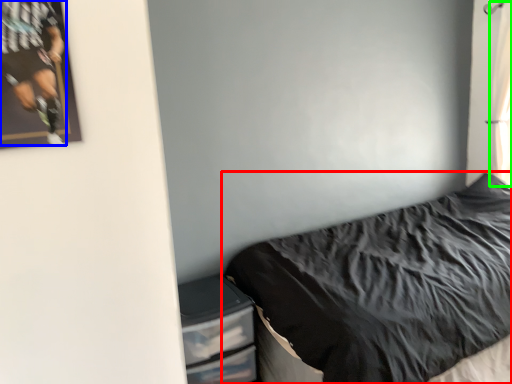
Question: Considering the real-world distances, which object is farthest from bed (highlighted by a red box)? person (highlighted by a blue box) or curtain (highlighted by a green box)?

Choices:
 (A) person
 (B) curtain

Answer: (A)